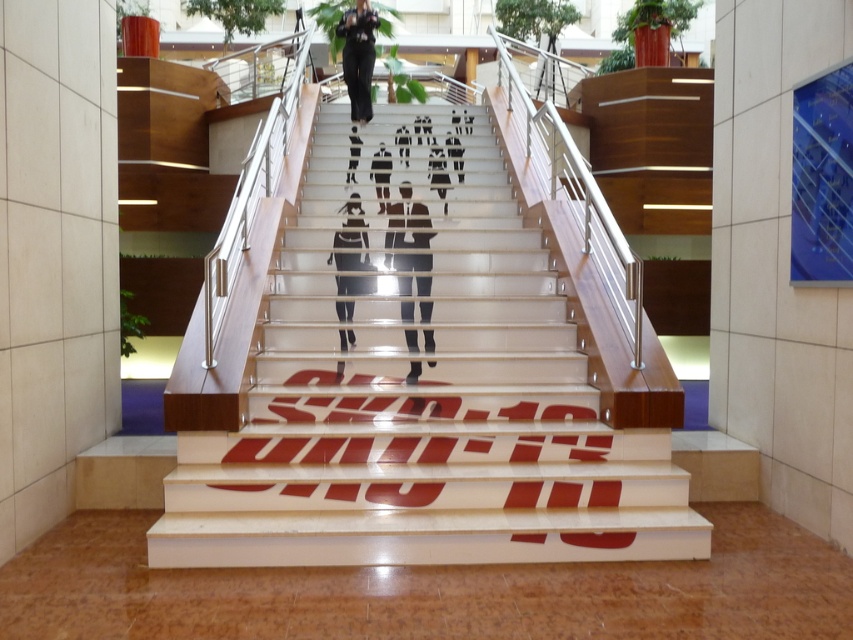
You are an interior designer observing the staircase. You notice the matte black figure at center and the black fabric pants at center. Which object is positioned more to the east side of the staircase?

The matte black figure at center is to the right of black fabric pants at center. Since the staircase is oriented with the handrails on the sides and the figures positioned centrally, the right side would correspond to the east direction if the staircase is facing north. Therefore, the matte black figure at center is more to the east side.